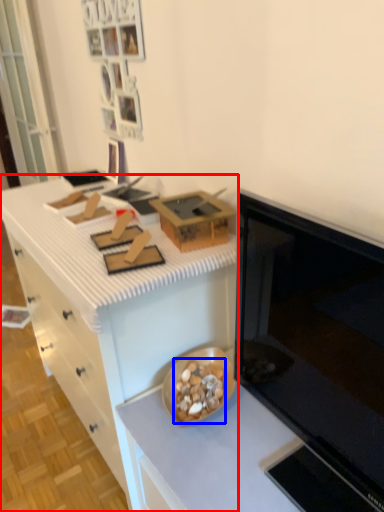
Question: Which point is closer to the camera, cabinetry (highlighted by a red box) or food (highlighted by a blue box)?

Choices:
 (A) cabinetry
 (B) food

Answer: (A)